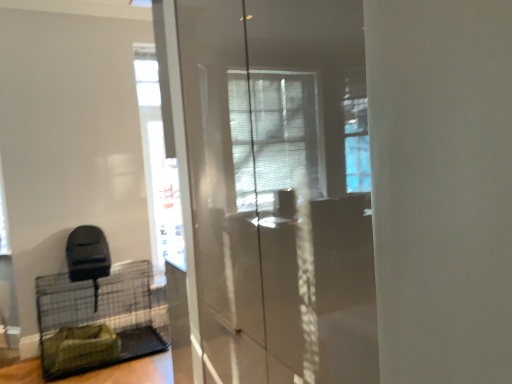
Question: Is transparent glass screen door at center inside the boundaries of green fabric birdcage at lower left, or outside?

Choices:
 (A) inside
 (B) outside

Answer: (B)

Question: From a real-world perspective, relative to green fabric birdcage at lower left, is transparent glass screen door at center vertically above or below?

Choices:
 (A) above
 (B) below

Answer: (A)

Question: Does point (194, 69) appear closer or farther from the camera than point (64, 359)?

Choices:
 (A) closer
 (B) farther

Answer: (A)

Question: From the image's perspective, is green fabric birdcage at lower left located above or below transparent glass screen door at center?

Choices:
 (A) above
 (B) below

Answer: (B)

Question: Is green fabric birdcage at lower left situated inside transparent glass screen door at center or outside?

Choices:
 (A) outside
 (B) inside

Answer: (A)

Question: Is green fabric birdcage at lower left wider or thinner than transparent glass screen door at center?

Choices:
 (A) wide
 (B) thin

Answer: (A)

Question: Considering their positions, is green fabric birdcage at lower left located in front of or behind transparent glass screen door at center?

Choices:
 (A) behind
 (B) front

Answer: (A)